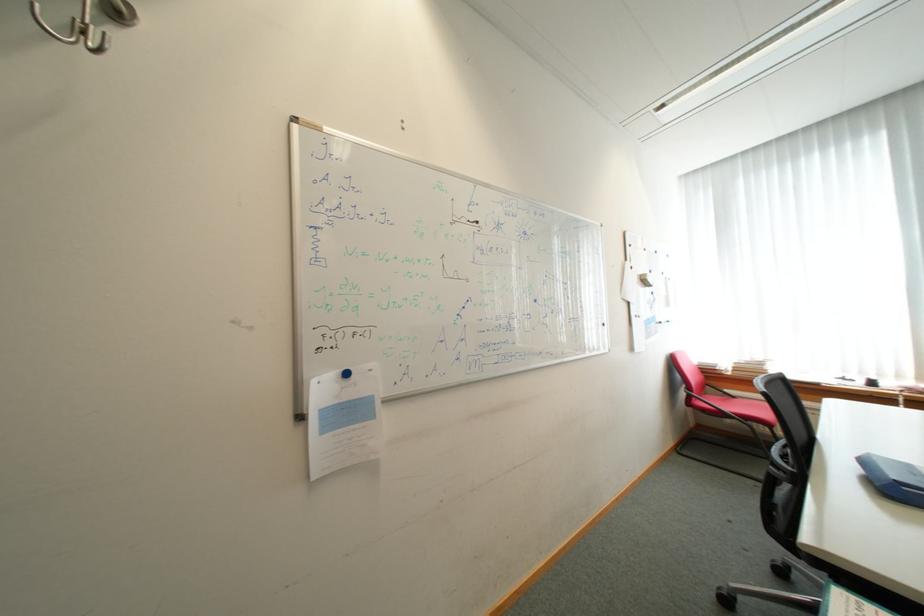
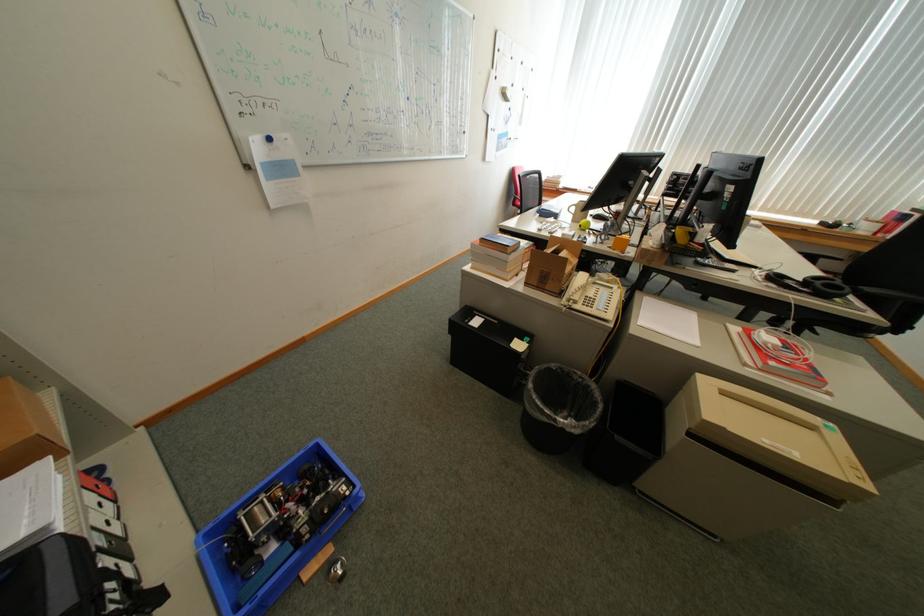
Question: I am providing you with two images of the same scene from different viewpoints. Please identify which objects are invisible in image2.

Choices:
 (A) white binder spine
 (B) chair sitting surface
 (C) white pump top
 (D) red chair sitting surface

Answer: (D)